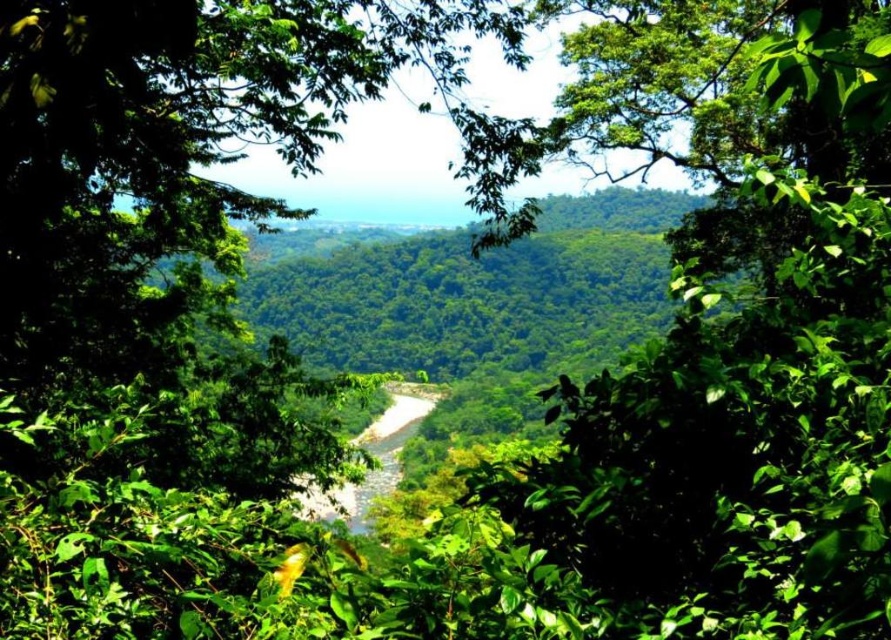
Question: Is the position of green leafy tree at center less distant than that of green leafy forest at center?

Choices:
 (A) no
 (B) yes

Answer: (B)

Question: Which point is farther to the camera?

Choices:
 (A) (463, 292)
 (B) (799, 156)

Answer: (A)

Question: Which of the following is the closest to the observer?

Choices:
 (A) green leafy forest at center
 (B) green leafy tree at center

Answer: (B)

Question: Can you confirm if green leafy tree at center is wider than green leafy forest at center?

Choices:
 (A) yes
 (B) no

Answer: (B)

Question: Does green leafy tree at center have a larger size compared to green leafy forest at center?

Choices:
 (A) no
 (B) yes

Answer: (B)